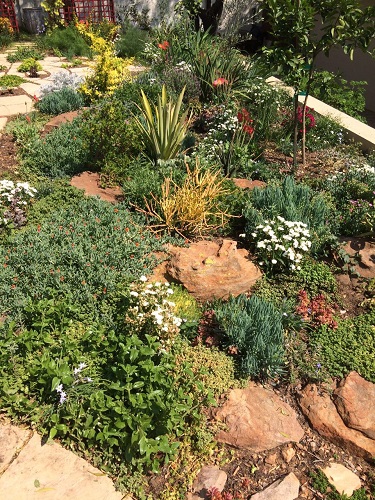
At what (x,y) coordinates should I click in order to perform the action: click on plant. Please return your answer as a coordinate pair (x, y). This screenshot has height=500, width=375. Looking at the image, I should click on (166, 145), (237, 133).